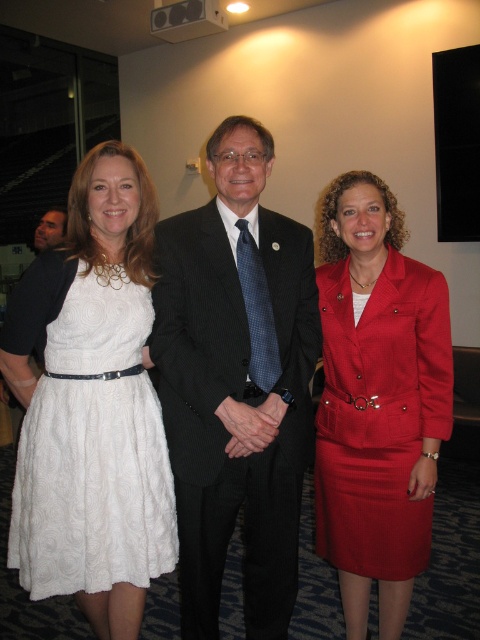
Between point (405, 476) and point (31, 444), which one is positioned behind?

Positioned behind is point (405, 476).

Which is more to the left, matte red skirt suit at center or white textured dress at left?

From the viewer's perspective, white textured dress at left appears more on the left side.

The image size is (480, 640). What do you see at coordinates (377, 401) in the screenshot?
I see `matte red skirt suit at center` at bounding box center [377, 401].

Where is `matte red skirt suit at center`? Image resolution: width=480 pixels, height=640 pixels. matte red skirt suit at center is located at coordinates (377, 401).

Consider the image. Can you confirm if black pinstripe suit at center is wider than white textured dress at left?

Correct, the width of black pinstripe suit at center exceeds that of white textured dress at left.

This screenshot has width=480, height=640. I want to click on black pinstripe suit at center, so click(236, 381).

The width and height of the screenshot is (480, 640). I want to click on black pinstripe suit at center, so click(236, 381).

How far apart are black pinstripe suit at center and matte red skirt suit at center?

The distance of black pinstripe suit at center from matte red skirt suit at center is 10.71 inches.

Can you confirm if black pinstripe suit at center is positioned below matte red skirt suit at center?

Actually, black pinstripe suit at center is above matte red skirt suit at center.

Is point (215, 252) behind point (324, 442)?

That is False.

This screenshot has height=640, width=480. I want to click on black pinstripe suit at center, so click(x=236, y=381).